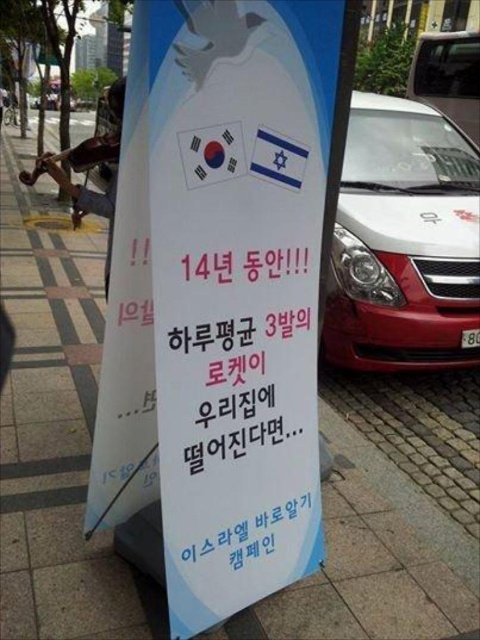
You are standing at the sidewalk in front of the signboard. You want to move to the white glossy car at center. In which direction should you walk to reach the car?

Since the white glossy car at center is located at point (405, 241) in the image, you should walk towards the center of the image to reach it.

You are a photographer planning to capture both the white glossy car at center and the metallic silver car at center in a single frame. Given their sizes, which car should you position closer to the camera to ensure both appear balanced in size in the photo?

The white glossy car at center is larger in size than the metallic silver car at center. To balance their sizes in the photo, position the smaller metallic silver car at center closer to the camera while keeping the larger white glossy car at center farther back.

You are a pedestrian standing on the sidewalk looking at the street. You see a white glossy car at center and a metallic silver car at center. Which car is positioned lower in the image?

The white glossy car at center is positioned below the metallic silver car at center, so it is lower in the image.